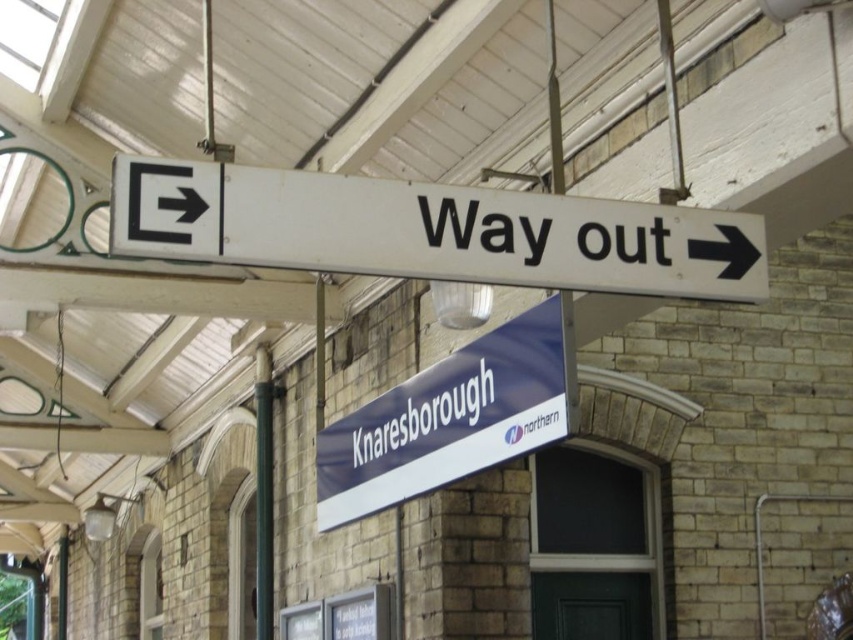
Can you confirm if white plastic sign at center is positioned below blue fabric sign at center?

Actually, white plastic sign at center is above blue fabric sign at center.

The image size is (853, 640). What are the coordinates of `white plastic sign at center` in the screenshot? It's located at (431, 230).